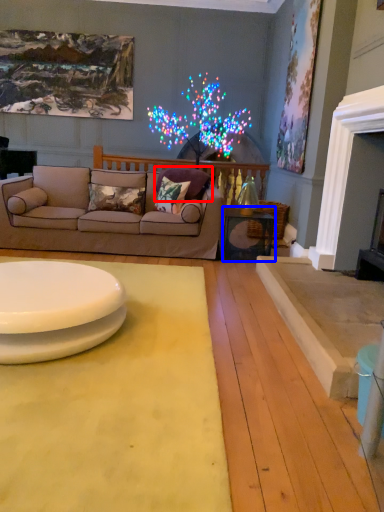
Question: Among these objects, which one is nearest to the camera, pillow (highlighted by a red box) or table (highlighted by a blue box)?

Choices:
 (A) pillow
 (B) table

Answer: (B)